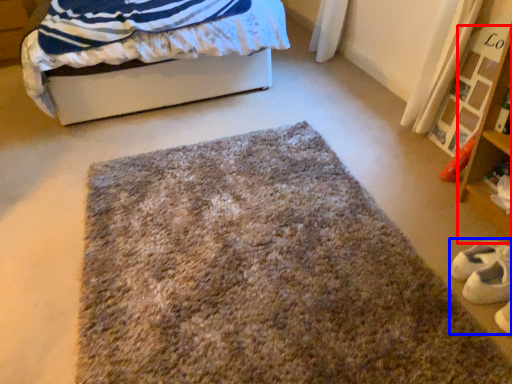
Question: Which object appears closest to the camera in this image, shelf (highlighted by a red box) or shoe (highlighted by a blue box)?

Choices:
 (A) shelf
 (B) shoe

Answer: (A)